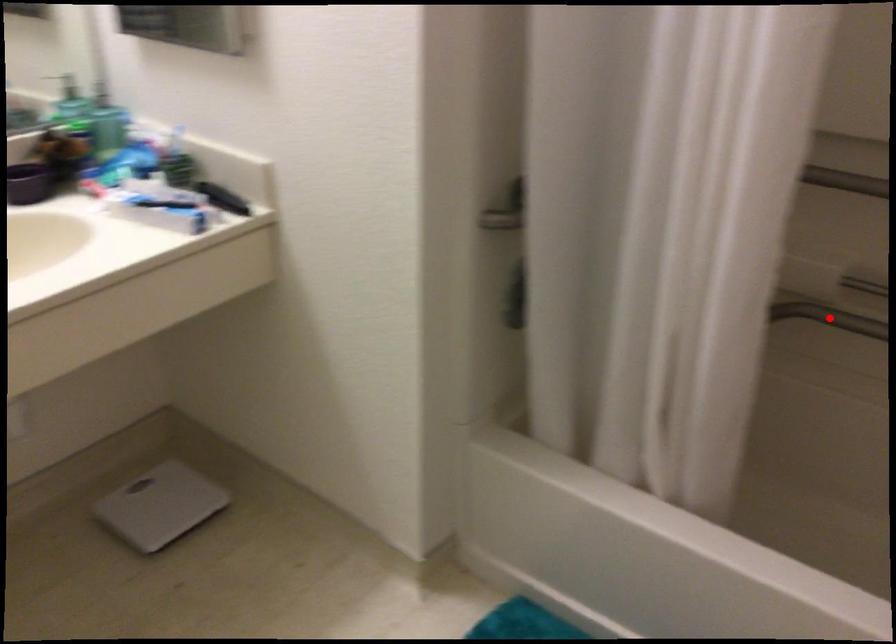
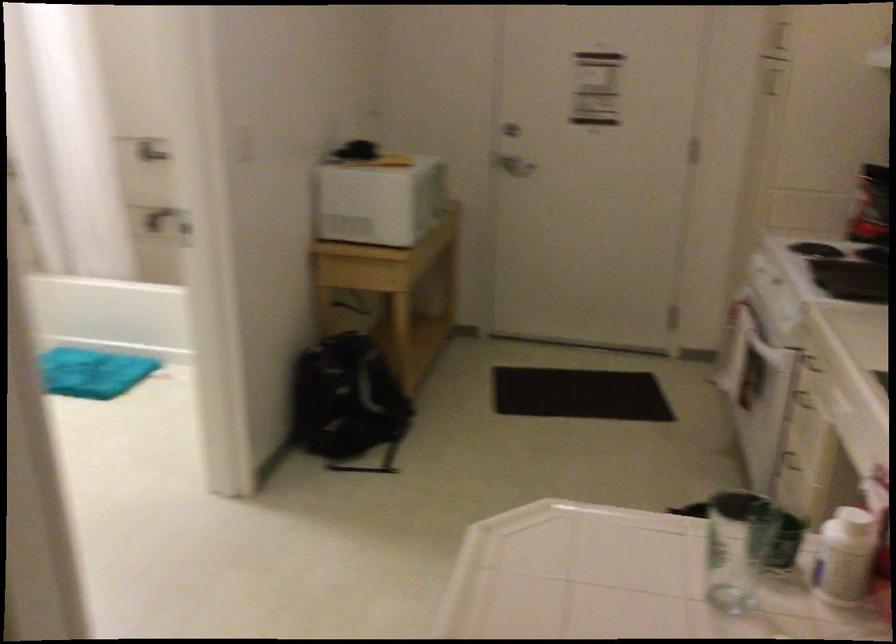
Question: I am providing you with two images of the same scene from different viewpoints. A red point is marked on the first image. At the location where the point appears in image 1, is it still visible in image 2?

Choices:
 (A) Yes
 (B) No

Answer: (B)